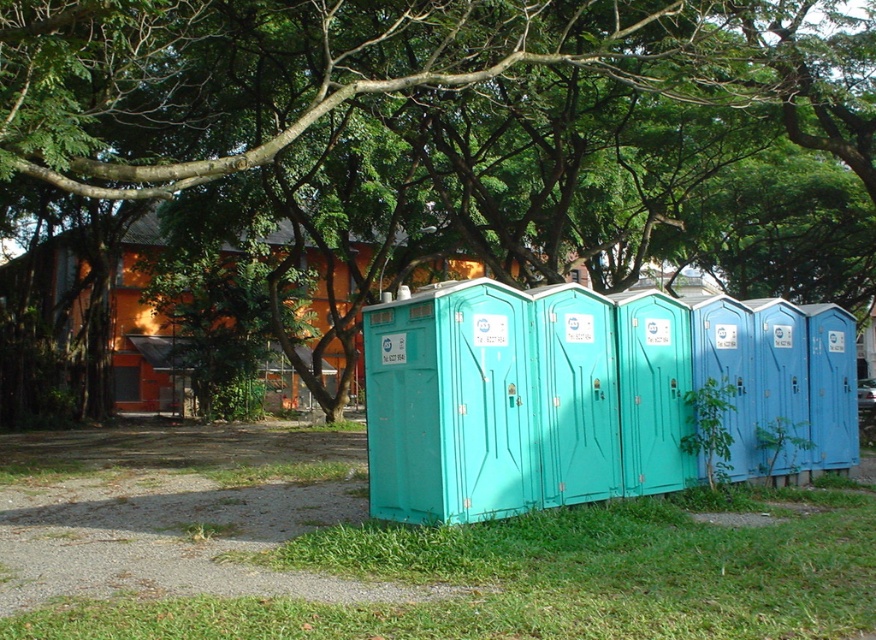
You are standing in front of the row of portable toilets and want to take a photo of the green leafy tree at upper center. Which direction should you face to ensure the tree is in the frame?

The green leafy tree at upper center is located at point coordinates, so you should face towards the upper center direction to capture it in your photo.

You are standing in front of the row of portable toilets and notice a specific point marked at coordinates point (420,97). What object is located at this point?

The point (420,97) corresponds to the green leafy tree at upper center.